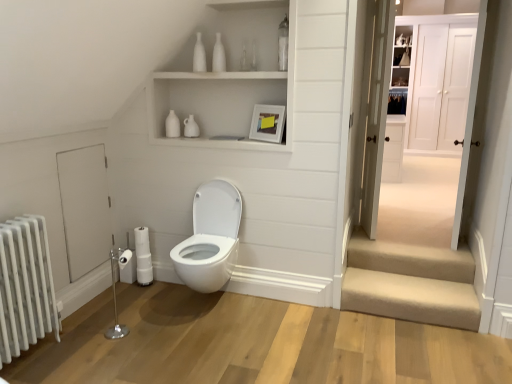
Locate an element on the screen. free spot to the right of white wooden door at upper right, the 2th door from the back is located at coordinates (435, 224).